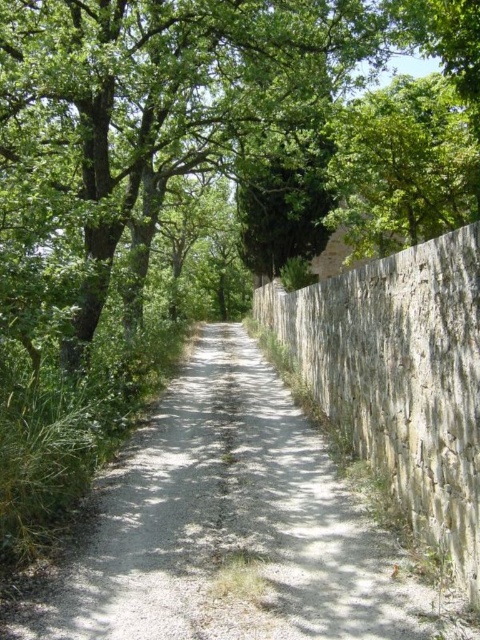
Question: Can you confirm if green leafy tree at center is smaller than gray gravel path at center?

Choices:
 (A) yes
 (B) no

Answer: (B)

Question: Is green leafy tree at center wider than gray gravel path at center?

Choices:
 (A) no
 (B) yes

Answer: (B)

Question: Among these objects, which one is farthest from the camera?

Choices:
 (A) gray gravel path at center
 (B) green leafy tree at center

Answer: (B)

Question: Does green leafy tree at center have a smaller size compared to gray gravel path at center?

Choices:
 (A) no
 (B) yes

Answer: (A)